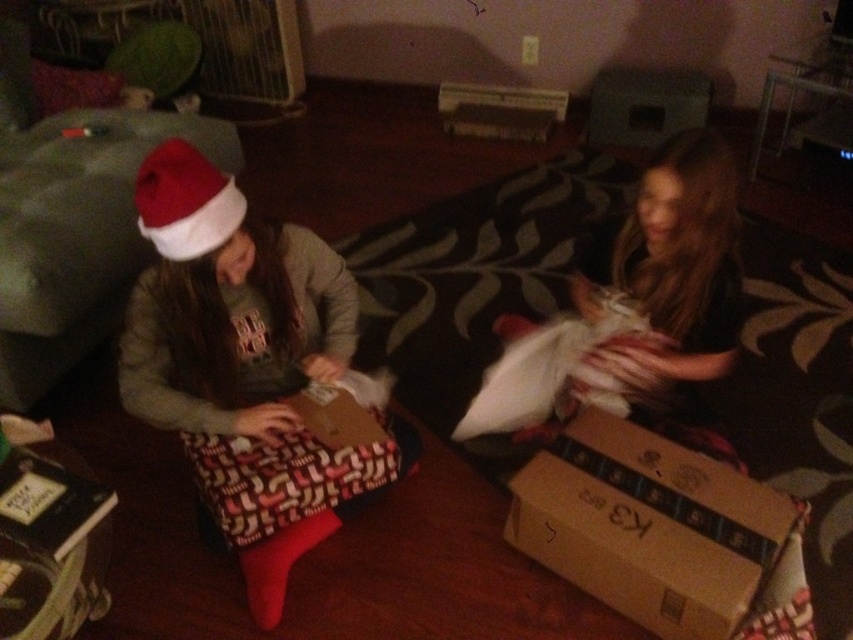
Question: Does white fluffy pillow at right have a greater width compared to red matte santa hat at upper left?

Choices:
 (A) no
 (B) yes

Answer: (B)

Question: Is brown cardboard box at lower right bigger than red matte santa hat at upper left?

Choices:
 (A) no
 (B) yes

Answer: (B)

Question: Which of these objects is positioned farthest from the red matte santa hat at upper left?

Choices:
 (A) matte brown gift at left
 (B) white fluffy pillow at right

Answer: (B)

Question: Which point is closer to the camera?

Choices:
 (A) (193, 248)
 (B) (724, 196)

Answer: (A)

Question: Which object appears closest to the camera in this image?

Choices:
 (A) white fluffy pillow at right
 (B) brown cardboard box at lower right

Answer: (B)

Question: Does matte brown gift at left lie behind red matte santa hat at upper left?

Choices:
 (A) no
 (B) yes

Answer: (A)